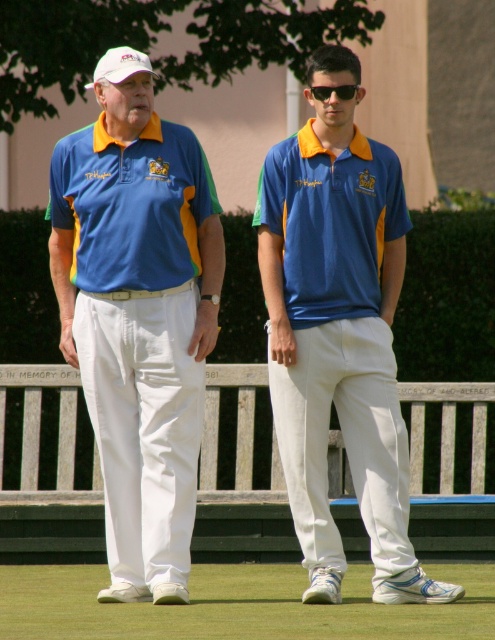
Question: Which point appears farthest from the camera in this image?

Choices:
 (A) [x=125, y=417]
 (B) [x=345, y=468]
 (C) [x=124, y=252]
 (D) [x=284, y=292]

Answer: (B)

Question: Which point appears closest to the camera in this image?

Choices:
 (A) (146, 268)
 (B) (311, 90)
 (C) (282, 348)

Answer: (C)

Question: Can you confirm if wooden bench at center is positioned above blue matte polo shirt at center?

Choices:
 (A) yes
 (B) no

Answer: (B)

Question: Is wooden bench at center thinner than blue matte polo shirt at center?

Choices:
 (A) yes
 (B) no

Answer: (A)

Question: Does wooden bench at center have a greater width compared to blue jersey at center?

Choices:
 (A) yes
 (B) no

Answer: (B)

Question: Which is farther from the wooden bench at center?

Choices:
 (A) blue jersey at center
 (B) black plastic sunglasses at center
 (C) matte blue polo shirt at left
 (D) blue matte polo shirt at center

Answer: (B)